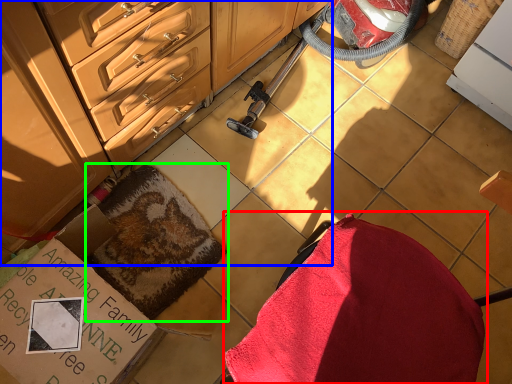
Question: Which is nearer to the swivel chair (highlighted by a red box)? cabinetry (highlighted by a blue box) or blanket (highlighted by a green box).

Choices:
 (A) cabinetry
 (B) blanket

Answer: (B)